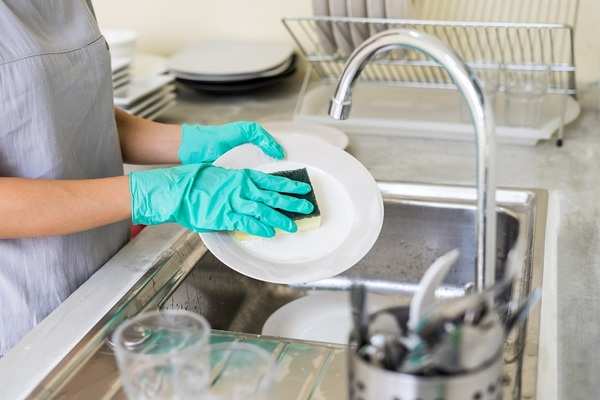
The height and width of the screenshot is (400, 600). What are the coordinates of `dirty dish counter` in the screenshot? It's located at (308, 369).